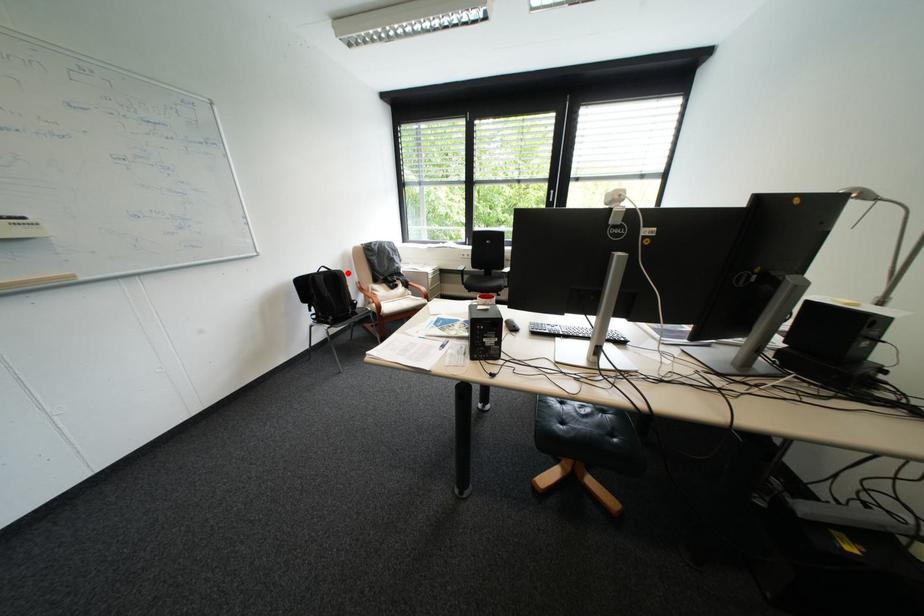
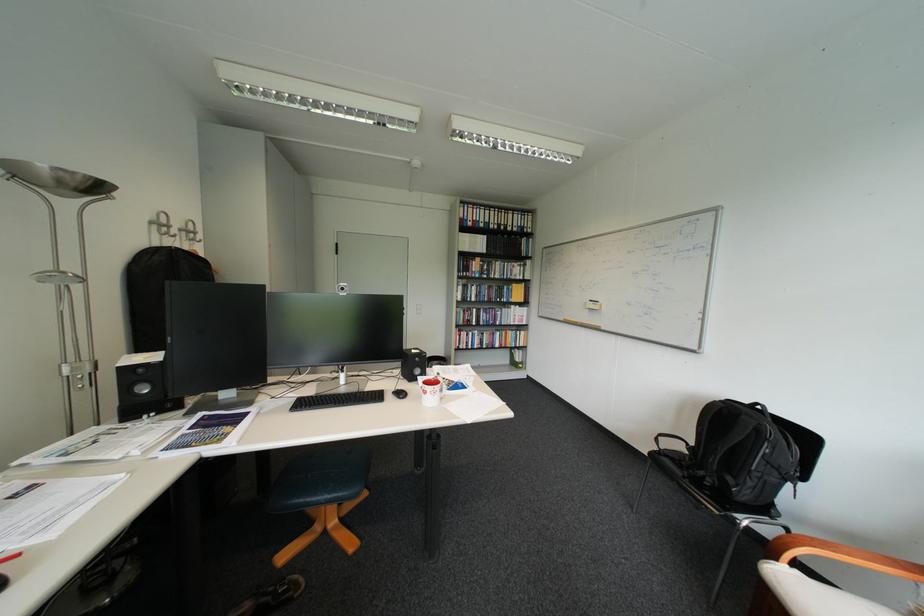
Where in the second image is the point corresponding to the highlighted location from the first image?

(756, 418)